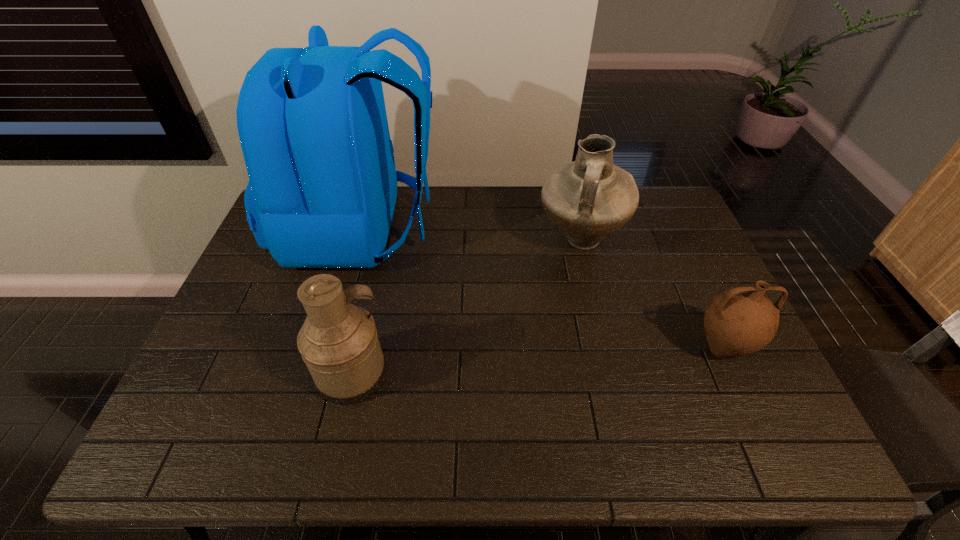
Identify which pitcher is the second nearest to the shortest pitcher. Please provide its 2D coordinates. Your answer should be formatted as a tuple, i.e. [(x, y)], where the tuple contains the x and y coordinates of a point satisfying the conditions above.

[(338, 342)]

In order to click on pitcher object that ranks as the closest to the second pitcher from right to left in this screenshot , I will do `click(739, 321)`.

I want to click on vacant region that satisfies the following two spatial constraints: 1. on the back of the backpack; 2. on the right side of the leftmost pitcher, so click(321, 374).

At what (x,y) coordinates should I click in order to perform the action: click on vacant space that satisfies the following two spatial constraints: 1. on the back of the leftmost pitcher; 2. on the left side of the backpack. Please return your answer as a coordinate pair (x, y). Image resolution: width=960 pixels, height=540 pixels. Looking at the image, I should click on (321, 374).

I want to click on free spot that satisfies the following two spatial constraints: 1. on the back of the leftmost pitcher; 2. on the left side of the tallest object, so click(x=321, y=374).

What are the coordinates of `vacant space that satisfies the following two spatial constraints: 1. on the back of the backpack; 2. on the right side of the shortest pitcher` in the screenshot? It's located at (328, 349).

Identify the location of vacant space that satisfies the following two spatial constraints: 1. on the back of the rightmost object; 2. on the left side of the tallest object. (328, 349).

Locate an element on the screen. The image size is (960, 540). free location that satisfies the following two spatial constraints: 1. on the back of the backpack; 2. on the left side of the rightmost pitcher is located at coordinates click(328, 349).